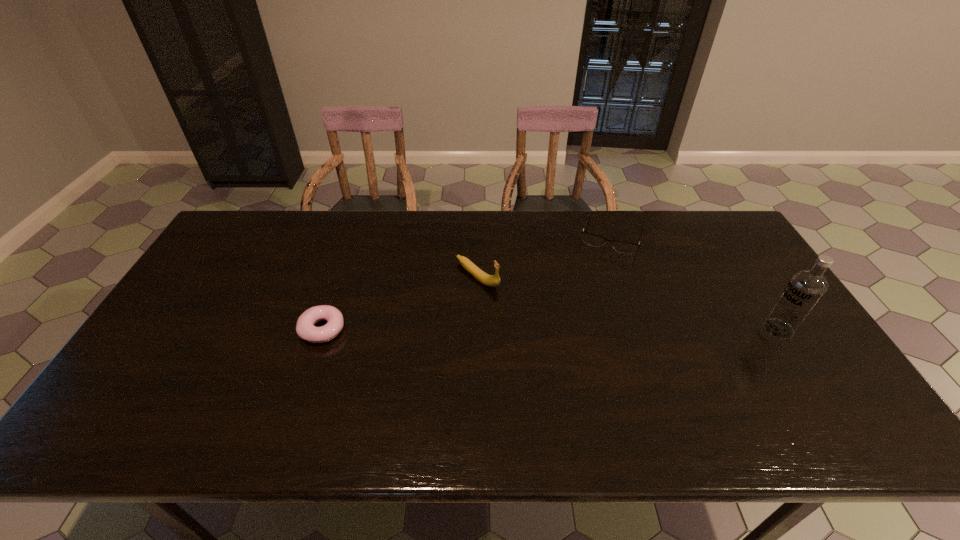
Locate an element on the screen. The image size is (960, 540). free space at the near edge of the desktop is located at coordinates (262, 395).

Identify the location of vacant region at the left edge of the desktop. The width and height of the screenshot is (960, 540). (217, 327).

Find the location of a particular element. This screenshot has height=540, width=960. vacant space at the right edge is located at coordinates (747, 318).

In the image, there is a desktop. In order to click on vacant space at the far left corner in this screenshot , I will do `click(251, 216)`.

In the image, there is a desktop. What are the coordinates of `vacant space at the near left corner` in the screenshot? It's located at (122, 381).

You are a GUI agent. You are given a task and a screenshot of the screen. Output one action in this format:
    pyautogui.click(x=<x>, y=<y>)
    Task: Click on the vacant area that lies between the leftmost object and the spectacles
    This screenshot has width=960, height=540.
    Given the screenshot: What is the action you would take?
    pyautogui.click(x=468, y=282)

You are a GUI agent. You are given a task and a screenshot of the screen. Output one action in this format:
    pyautogui.click(x=<x>, y=<y>)
    Task: Click on the vacant area that lies between the third shortest object and the third object from left to right
    The image size is (960, 540).
    Given the screenshot: What is the action you would take?
    pyautogui.click(x=544, y=256)

What are the coordinates of `free space that is in between the doughnut and the spectacles` in the screenshot? It's located at (468, 282).

At what (x,y) coordinates should I click in order to perform the action: click on vacant area that lies between the second object from left to right and the farthest object. Please return your answer as a coordinate pair (x, y). The height and width of the screenshot is (540, 960). Looking at the image, I should click on (544, 256).

The width and height of the screenshot is (960, 540). I want to click on free area in between the third object from left to right and the doughnut, so click(468, 282).